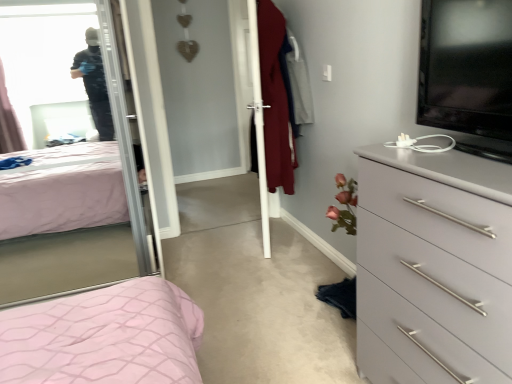
Question: Is white glossy screen door at center at the left side of black glossy tv at upper right?

Choices:
 (A) no
 (B) yes

Answer: (B)

Question: Is white glossy screen door at center with black glossy tv at upper right?

Choices:
 (A) yes
 (B) no

Answer: (B)

Question: Considering the relative sizes of white glossy screen door at center and black glossy tv at upper right in the image provided, is white glossy screen door at center bigger than black glossy tv at upper right?

Choices:
 (A) yes
 (B) no

Answer: (A)

Question: Is white glossy screen door at center completely or partially outside of black glossy tv at upper right?

Choices:
 (A) yes
 (B) no

Answer: (A)

Question: Is white glossy screen door at center oriented towards black glossy tv at upper right?

Choices:
 (A) no
 (B) yes

Answer: (A)

Question: From the image's perspective, would you say white glossy screen door at center is positioned over black glossy tv at upper right?

Choices:
 (A) no
 (B) yes

Answer: (B)

Question: Could white glossy screen door at center be considered to be inside gray matte chest of drawers at right?

Choices:
 (A) yes
 (B) no

Answer: (B)

Question: Does gray matte chest of drawers at right have a lesser height compared to white glossy screen door at center?

Choices:
 (A) no
 (B) yes

Answer: (B)

Question: Is gray matte chest of drawers at right oriented away from white glossy screen door at center?

Choices:
 (A) yes
 (B) no

Answer: (B)

Question: Is gray matte chest of drawers at right facing towards white glossy screen door at center?

Choices:
 (A) yes
 (B) no

Answer: (B)

Question: Can you confirm if gray matte chest of drawers at right is thinner than white glossy screen door at center?

Choices:
 (A) no
 (B) yes

Answer: (A)

Question: Is gray matte chest of drawers at right to the right of white glossy screen door at center from the viewer's perspective?

Choices:
 (A) no
 (B) yes

Answer: (B)

Question: Is gray matte chest of drawers at right wider than clear glass mirror at upper left?

Choices:
 (A) no
 (B) yes

Answer: (A)